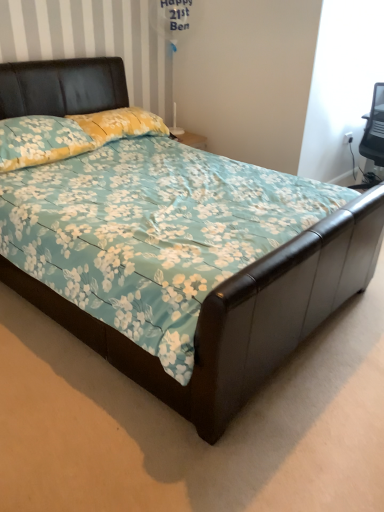
Question: Considering the positions of floral fabric pillow at upper left, which is counted as the 2th pillow, starting from the front, and floral fabric pillow at upper left, the 2th pillow positioned from the back, in the image, is floral fabric pillow at upper left, which is counted as the 2th pillow, starting from the front, wider or thinner than floral fabric pillow at upper left, the 2th pillow positioned from the back,?

Choices:
 (A) thin
 (B) wide

Answer: (A)

Question: Do you think floral fabric pillow at upper left, which is counted as the 2th pillow, starting from the front, is within floral fabric pillow at upper left, the 2th pillow positioned from the back, or outside of it?

Choices:
 (A) outside
 (B) inside

Answer: (A)

Question: Does point (157, 123) appear closer or farther from the camera than point (21, 157)?

Choices:
 (A) closer
 (B) farther

Answer: (B)

Question: Is floral fabric pillow at upper left, which appears as the 1th pillow when viewed from the front, situated inside floral fabric pillow at upper left, which is counted as the 2th pillow, starting from the front, or outside?

Choices:
 (A) inside
 (B) outside

Answer: (B)

Question: Is floral fabric pillow at upper left, which appears as the 1th pillow when viewed from the front, wider or thinner than floral fabric pillow at upper left, which is counted as the 2th pillow, starting from the front?

Choices:
 (A) wide
 (B) thin

Answer: (A)

Question: Is floral fabric pillow at upper left, the 2th pillow positioned from the back, in front of or behind floral fabric pillow at upper left, arranged as the first pillow when viewed from the back, in the image?

Choices:
 (A) front
 (B) behind

Answer: (A)

Question: Considering the positions of floral fabric pillow at upper left, which appears as the 1th pillow when viewed from the front, and floral fabric pillow at upper left, which is counted as the 2th pillow, starting from the front, in the image, is floral fabric pillow at upper left, which appears as the 1th pillow when viewed from the front, bigger or smaller than floral fabric pillow at upper left, which is counted as the 2th pillow, starting from the front,?

Choices:
 (A) big
 (B) small

Answer: (A)